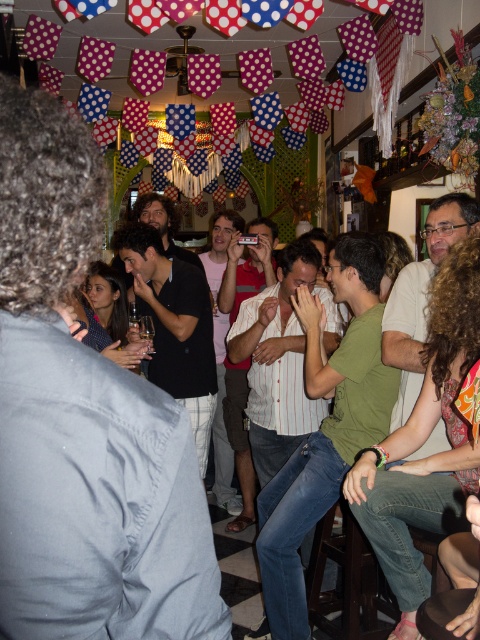
The height and width of the screenshot is (640, 480). Describe the element at coordinates (175, 324) in the screenshot. I see `black matte shirt at center` at that location.

Between black matte shirt at center and pink cotton shirt at center, which one is positioned lower?

Positioned lower is pink cotton shirt at center.

The width and height of the screenshot is (480, 640). Identify the location of black matte shirt at center. (175, 324).

Locate an element on the screen. black matte shirt at center is located at coordinates (175, 324).

Who is more forward, (291, 349) or (204, 296)?

Point (291, 349)

Is point (229, 244) closer to viewer compared to point (133, 225)?

That is False.

Identify the location of white striped shirt at center. Image resolution: width=480 pixels, height=640 pixels. (276, 362).

Does white striped shirt at center have a larger size compared to striped shirt at center?

Correct, white striped shirt at center is larger in size than striped shirt at center.

Where is `white striped shirt at center`? white striped shirt at center is located at coordinates (276, 362).

Is point (248, 412) behind point (225, 403)?

No, (248, 412) is closer to viewer.

You are a GUI agent. You are given a task and a screenshot of the screen. Output one action in this format:
    pyautogui.click(x=<x>, y=<y>)
    Task: Click on the white striped shirt at center
    
    Given the screenshot: What is the action you would take?
    click(276, 362)